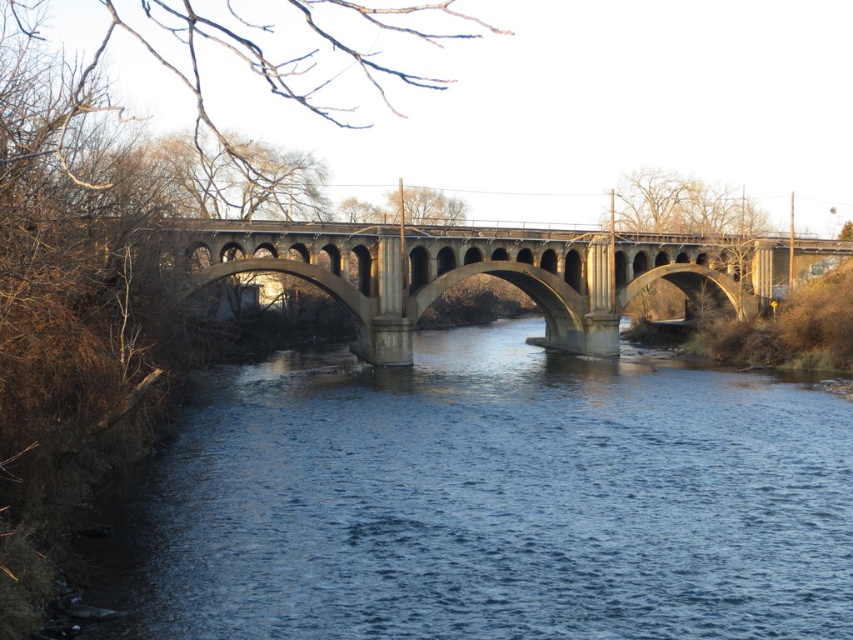
Does blue water at center have a lesser height compared to concrete bridge at center?

Indeed, blue water at center has a lesser height compared to concrete bridge at center.

Does point (444, 577) come closer to viewer compared to point (560, 232)?

Yes, point (444, 577) is in front of point (560, 232).

Is point (601, 536) farther from camera compared to point (590, 230)?

That is False.

You are a GUI agent. You are given a task and a screenshot of the screen. Output one action in this format:
    pyautogui.click(x=<x>, y=<y>)
    Task: Click on the blue water at center
    The image size is (853, 640).
    Given the screenshot: What is the action you would take?
    pyautogui.click(x=490, y=500)